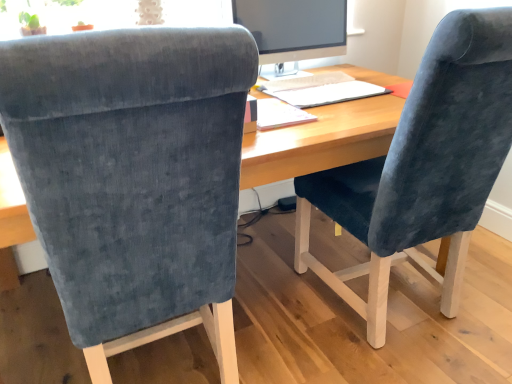
Question: Are velvet blue chair at right, which is the first chair from right to left, and velvet blue chair at center, the second chair viewed from the right, far apart?

Choices:
 (A) no
 (B) yes

Answer: (A)

Question: Is velvet blue chair at right, the 2th chair viewed from the left, facing away from velvet blue chair at center, the second chair viewed from the right?

Choices:
 (A) no
 (B) yes

Answer: (A)

Question: From a real-world perspective, is velvet blue chair at right, which is the first chair from right to left, located higher than velvet blue chair at center, which is counted as the 1th chair, starting from the left?

Choices:
 (A) no
 (B) yes

Answer: (B)

Question: Could you tell me if velvet blue chair at right, the 2th chair viewed from the left, is turned towards velvet blue chair at center, which is counted as the 1th chair, starting from the left?

Choices:
 (A) no
 (B) yes

Answer: (A)

Question: Is velvet blue chair at right, the 2th chair viewed from the left, smaller than velvet blue chair at center, the second chair viewed from the right?

Choices:
 (A) no
 (B) yes

Answer: (B)

Question: Considering the relative sizes of velvet blue chair at right, which is the first chair from right to left, and velvet blue chair at center, the second chair viewed from the right, in the image provided, is velvet blue chair at right, which is the first chair from right to left, taller than velvet blue chair at center, the second chair viewed from the right,?

Choices:
 (A) yes
 (B) no

Answer: (B)

Question: Is velvet blue chair at right, the 2th chair viewed from the left, outside of wooden desk at center?

Choices:
 (A) yes
 (B) no

Answer: (B)

Question: Is velvet blue chair at right, the 2th chair viewed from the left, thinner than wooden desk at center?

Choices:
 (A) no
 (B) yes

Answer: (B)

Question: Is velvet blue chair at right, which is the first chair from right to left, oriented towards wooden desk at center?

Choices:
 (A) no
 (B) yes

Answer: (B)

Question: Does velvet blue chair at right, which is the first chair from right to left, have a greater width compared to wooden desk at center?

Choices:
 (A) no
 (B) yes

Answer: (A)

Question: Does velvet blue chair at right, the 2th chair viewed from the left, appear on the left side of wooden desk at center?

Choices:
 (A) yes
 (B) no

Answer: (B)

Question: From a real-world perspective, is velvet blue chair at right, which is the first chair from right to left, beneath wooden desk at center?

Choices:
 (A) no
 (B) yes

Answer: (A)

Question: Is velvet blue chair at center, which is counted as the 1th chair, starting from the left, completely or partially inside white paper notepad at center?

Choices:
 (A) no
 (B) yes

Answer: (A)